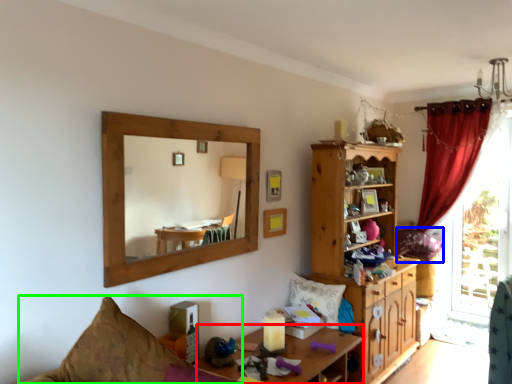
Question: Based on their relative distances, which object is nearer to desk (highlighted by a red box)? Choose from pillow (highlighted by a blue box) and couch (highlighted by a green box).

Choices:
 (A) pillow
 (B) couch

Answer: (B)